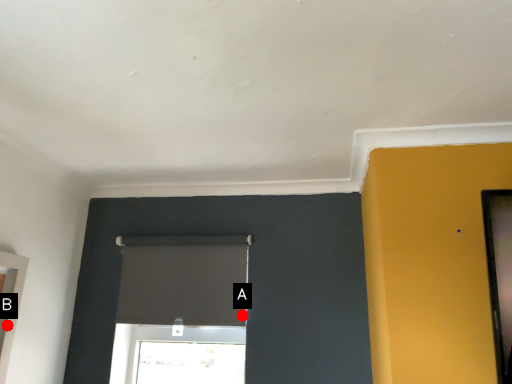
Question: Two points are circled on the image, labeled by A and B beside each circle. Which point is closer to the camera?

Choices:
 (A) A is closer
 (B) B is closer

Answer: (B)